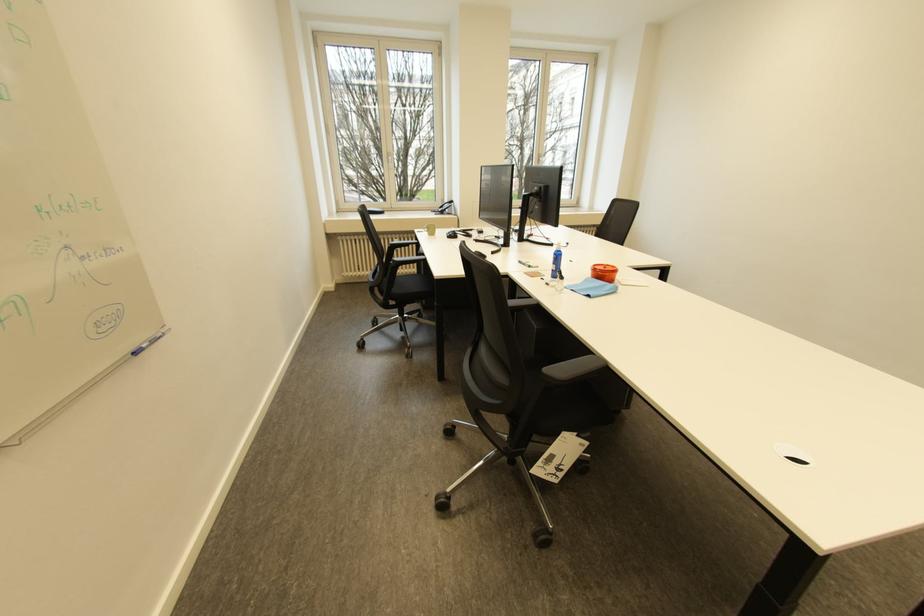
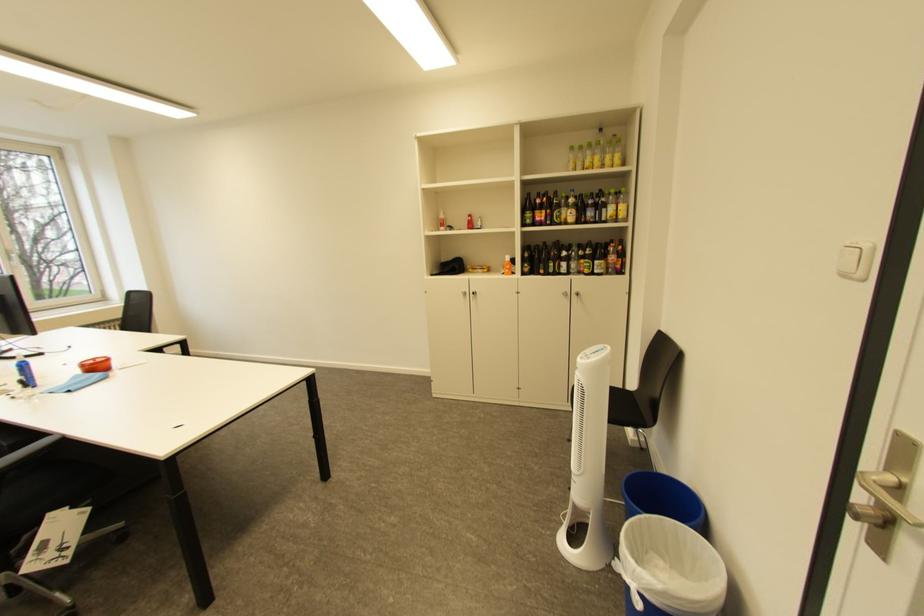
Find the pixel in the second image that matches pixel 563 265 in the first image.

(30, 378)